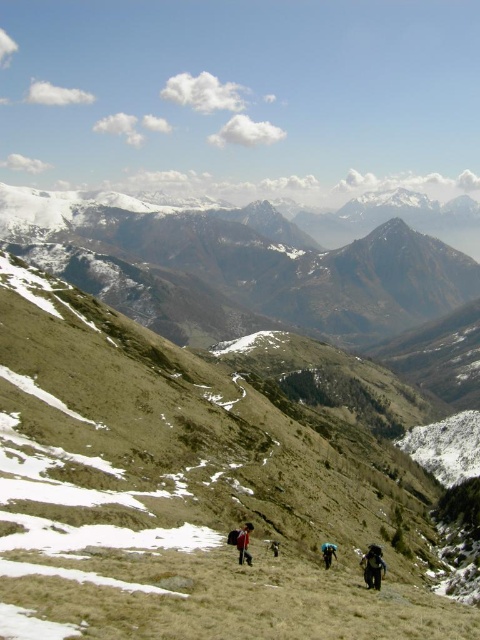
Question: Which point appears farthest from the camera in this image?

Choices:
 (A) (325, 564)
 (B) (229, 497)

Answer: (B)

Question: In this image, where is snowy rocky mountain range at upper center located relative to camouflage fabric backpack at center?

Choices:
 (A) right
 (B) left

Answer: (A)

Question: Considering the real-world distances, which object is farthest from the camouflage fabric backpack at center?

Choices:
 (A) blue fabric backpack at center
 (B) dark brown backpack at center
 (C) green grassy hillside at center

Answer: (C)

Question: Considering the relative positions of green grassy hillside at center and camouflage fabric backpack at center in the image provided, where is green grassy hillside at center located with respect to camouflage fabric backpack at center?

Choices:
 (A) below
 (B) above

Answer: (B)

Question: In this image, where is snowy rocky mountain range at upper center located relative to dark brown backpack at center?

Choices:
 (A) right
 (B) left

Answer: (B)

Question: Among these objects, which one is nearest to the camera?

Choices:
 (A) snowy rocky mountain range at upper center
 (B) dark blue fabric backpack at center

Answer: (B)